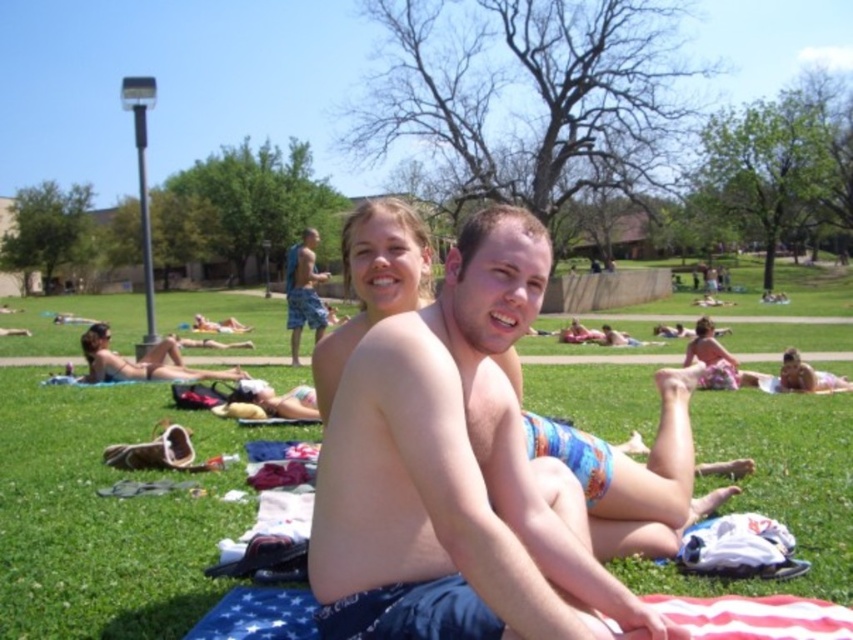
How far apart are blue swim trunks at center and blue camouflage shorts at center?

The distance of blue swim trunks at center from blue camouflage shorts at center is 32.23 feet.

Where is `blue swim trunks at center`? blue swim trunks at center is located at coordinates (456, 460).

Does point (125, 365) lie behind point (312, 240)?

No, it is not.

Between matte bikini at center and blue camouflage shorts at center, which one has more height?

blue camouflage shorts at center

Who is more distant from viewer, [154,378] or [312,282]?

The point [312,282] is more distant.

The height and width of the screenshot is (640, 853). I want to click on matte bikini at center, so click(x=141, y=362).

Who is lower down, green grass at center or blue camouflage shorts at center?

green grass at center is below.

Which is more to the right, green grass at center or blue camouflage shorts at center?

green grass at center is more to the right.

Between point (128, 541) and point (303, 253), which one is positioned in front?

Point (128, 541) is more forward.

You are a GUI agent. You are given a task and a screenshot of the screen. Output one action in this format:
    pyautogui.click(x=<x>, y=<y>)
    Task: Click on the green grass at center
    
    Given the screenshot: What is the action you would take?
    pyautogui.click(x=108, y=513)